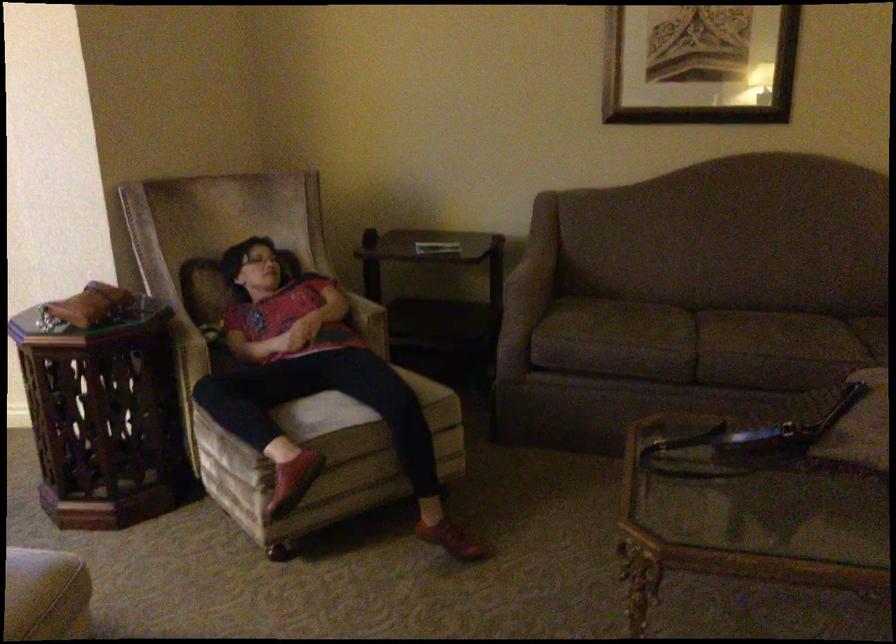
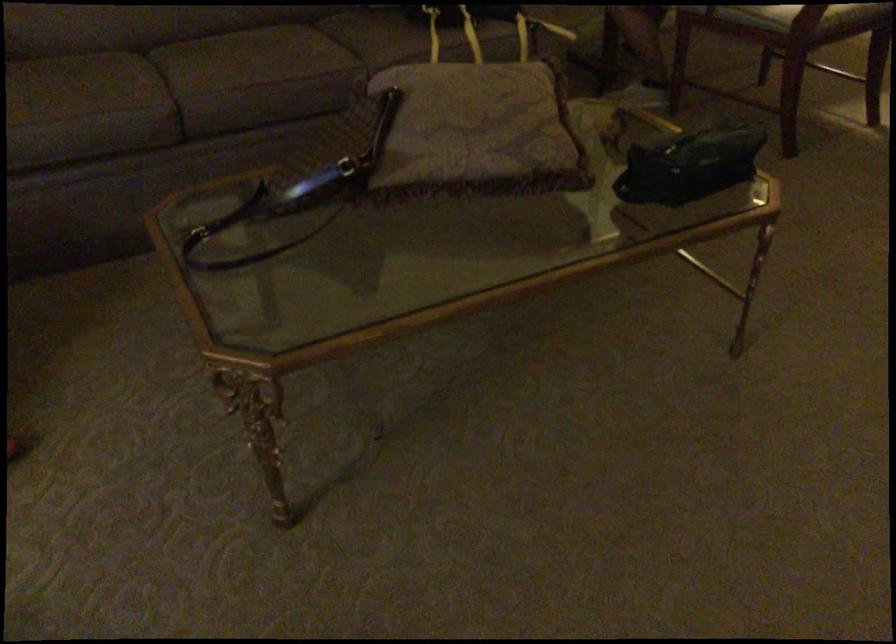
How did the camera likely rotate?

The camera's rotation is toward right-down.